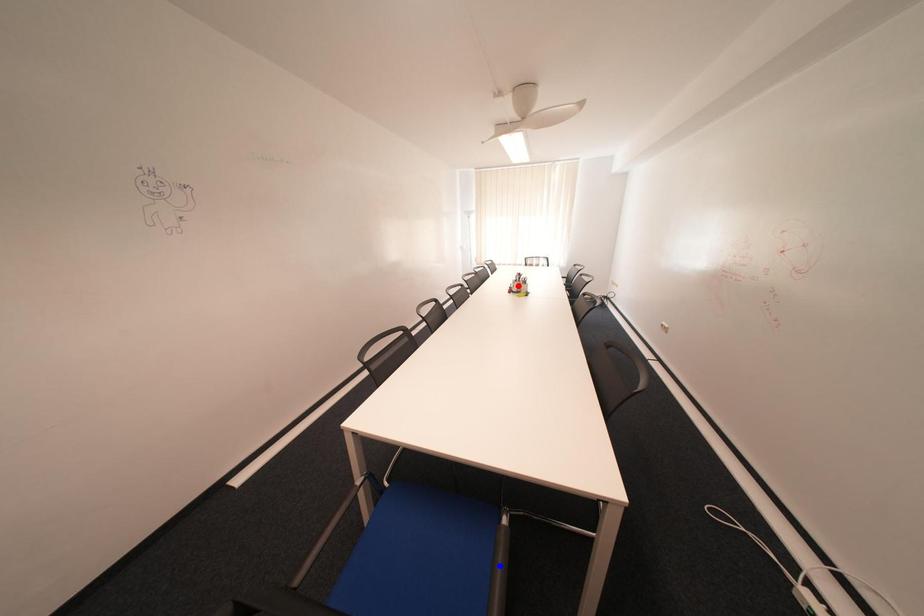
Question: Which of the two points in the image is closer to the camera?

Choices:
 (A) Blue point is closer.
 (B) Red point is closer.

Answer: (A)